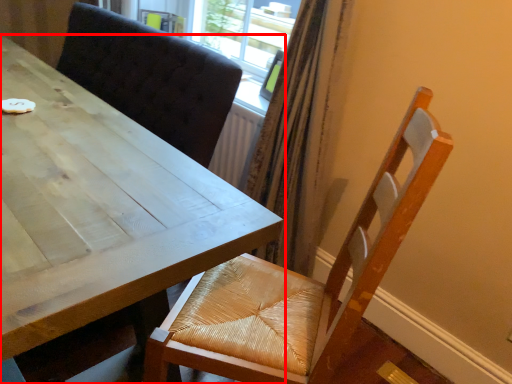
Question: From the image's perspective, considering the relative positions of table (annotated by the red box) and chair in the image provided, where is table (annotated by the red box) located with respect to the staircase?

Choices:
 (A) above
 (B) below

Answer: (A)